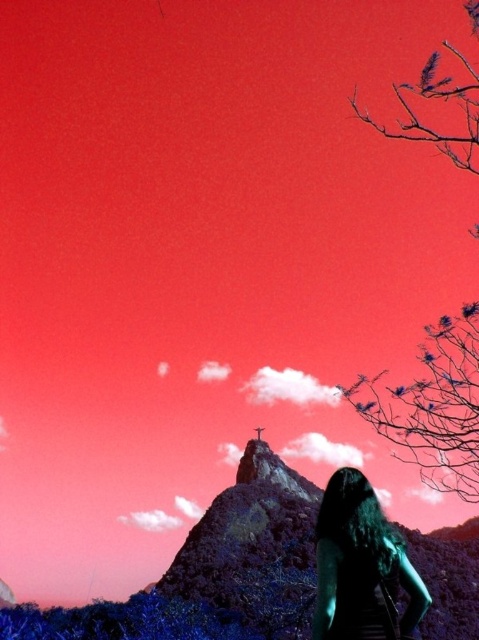
You are standing in the scene and want to take a photo of the smooth bark tree at right. Where should you position yourself to capture it in the frame?

To capture the smooth bark tree at right in the frame, position yourself at the coordinates corresponding to its 2D location at point (433, 406).

You are standing in the scene and want to touch both the smooth bark tree at right and the green matte hair at lower right. Which object should you reach for first based on their positions?

You should reach for the smooth bark tree at right first because it is closer to you than the green matte hair at lower right.

You are a hiker carrying a 1.8 meter long ladder. You want to place it between the smooth bark tree at right and the green matte hair at lower right. Is the space between them wide enough to fit the ladder horizontally?

The distance between the smooth bark tree at right and the green matte hair at lower right is 23.64 meters, which is significantly wider than the ladder. Therefore, the ladder can easily fit horizontally between them.